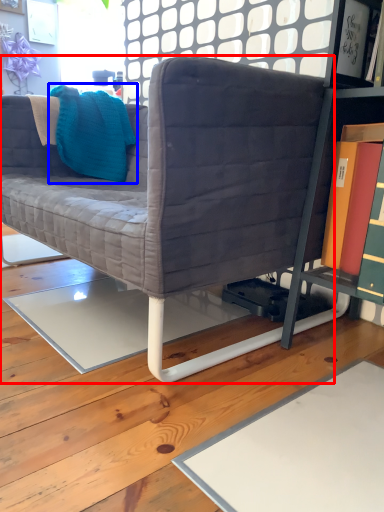
Question: Which object appears closest to the camera in this image, studio couch (highlighted by a red box) or throw pillow (highlighted by a blue box)?

Choices:
 (A) studio couch
 (B) throw pillow

Answer: (A)